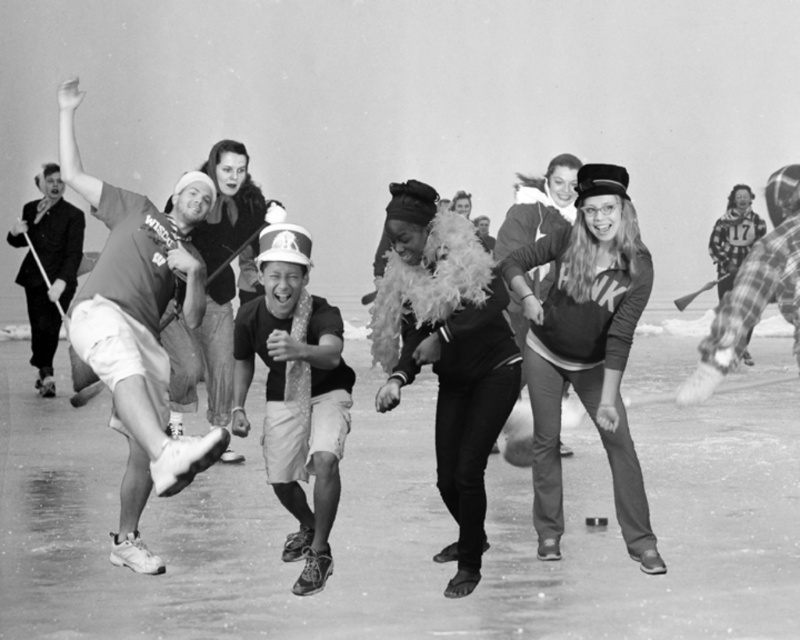
Question: Is matte black sweater at center closer to camera compared to smooth black suit at left?

Choices:
 (A) no
 (B) yes

Answer: (B)

Question: Which of these objects is positioned farthest from the smooth black suit at left?

Choices:
 (A) feather boa at center
 (B) matte brown shirt at left
 (C) matte black sweater at center
 (D) polka dot tie at center

Answer: (C)

Question: Does matte black sweater at center come behind polka dot tie at center?

Choices:
 (A) yes
 (B) no

Answer: (A)

Question: Which is nearer to the matte brown shirt at left?

Choices:
 (A) matte black sweater at center
 (B) smooth black suit at left

Answer: (A)

Question: Does matte black sweater at center appear on the left side of polka dot tie at center?

Choices:
 (A) no
 (B) yes

Answer: (A)

Question: Which is farther from the smooth black suit at left?

Choices:
 (A) feather boa at center
 (B) polka dot tie at center
 (C) matte black sweater at center
 (D) matte brown shirt at left

Answer: (C)